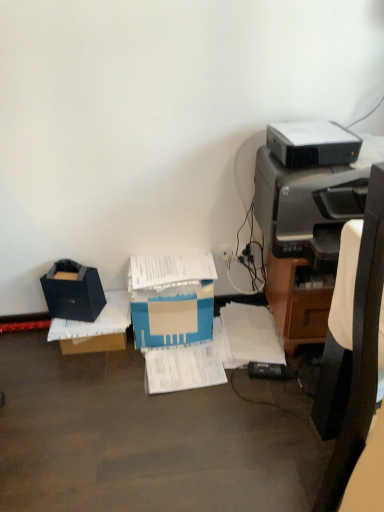
Question: Is the surface of black plastic printer at upper right, placed as the first printer when sorted from top to bottom, in direct contact with black fabric bag at left, which is counted as the second storage box, starting from the bottom?

Choices:
 (A) no
 (B) yes

Answer: (A)

Question: Is black plastic printer at upper right, arranged as the 2th printer when ordered from the bottom, not near black fabric bag at left, the first storage box viewed from the top?

Choices:
 (A) yes
 (B) no

Answer: (B)

Question: Does black plastic printer at upper right, placed as the first printer when sorted from top to bottom, have a lesser height compared to black fabric bag at left, the first storage box viewed from the top?

Choices:
 (A) no
 (B) yes

Answer: (B)

Question: From the image's perspective, is black plastic printer at upper right, placed as the first printer when sorted from top to bottom, located beneath black fabric bag at left, which is counted as the second storage box, starting from the bottom?

Choices:
 (A) no
 (B) yes

Answer: (A)

Question: Does black plastic printer at upper right, placed as the first printer when sorted from top to bottom, appear on the right side of black fabric bag at left, the first storage box viewed from the top?

Choices:
 (A) no
 (B) yes

Answer: (B)

Question: From a real-world perspective, is black plastic printer at upper right, placed as the first printer when sorted from top to bottom, below black fabric bag at left, which is counted as the second storage box, starting from the bottom?

Choices:
 (A) yes
 (B) no

Answer: (B)

Question: Are black plastic chair at right and white paper at center, placed as the 1th document when sorted from left to right, making contact?

Choices:
 (A) yes
 (B) no

Answer: (B)

Question: Would you consider black plastic chair at right to be distant from white paper at center, placed as the 1th document when sorted from left to right?

Choices:
 (A) yes
 (B) no

Answer: (B)

Question: Does black plastic chair at right lie behind white paper at center, placed as the 1th document when sorted from left to right?

Choices:
 (A) yes
 (B) no

Answer: (B)

Question: From the image's perspective, would you say black plastic chair at right is shown under white paper at center, which is the second document from right to left?

Choices:
 (A) no
 (B) yes

Answer: (A)

Question: Is black plastic chair at right wider than white paper at center, which is the second document from right to left?

Choices:
 (A) no
 (B) yes

Answer: (B)

Question: Considering the relative positions of black plastic chair at right and white paper at center, placed as the 1th document when sorted from left to right, in the image provided, is black plastic chair at right to the right of white paper at center, placed as the 1th document when sorted from left to right, from the viewer's perspective?

Choices:
 (A) no
 (B) yes

Answer: (B)

Question: Is black plastic chair at right outside of blue cardboard box at center?

Choices:
 (A) yes
 (B) no

Answer: (A)